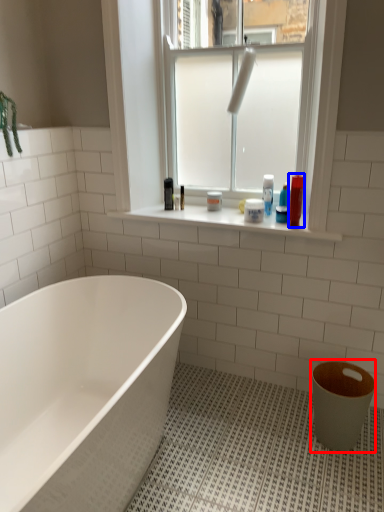
Question: Among these objects, which one is nearest to the camera, toilet bowl (highlighted by a red box) or toiletry (highlighted by a blue box)?

Choices:
 (A) toilet bowl
 (B) toiletry

Answer: (A)